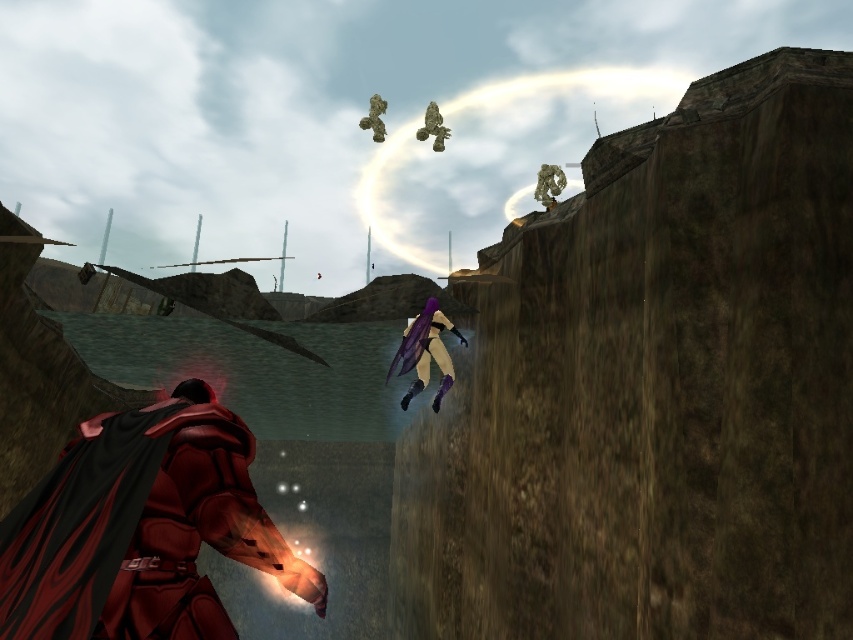
Who is higher up, shiny red armor at center or purple matte wings at center?

purple matte wings at center is above.

Between point (80, 584) and point (442, 349), which one is positioned behind?

Point (442, 349)

What do you see at coordinates (141, 529) in the screenshot? I see `shiny red armor at center` at bounding box center [141, 529].

Find the location of a particular element. shiny red armor at center is located at coordinates (141, 529).